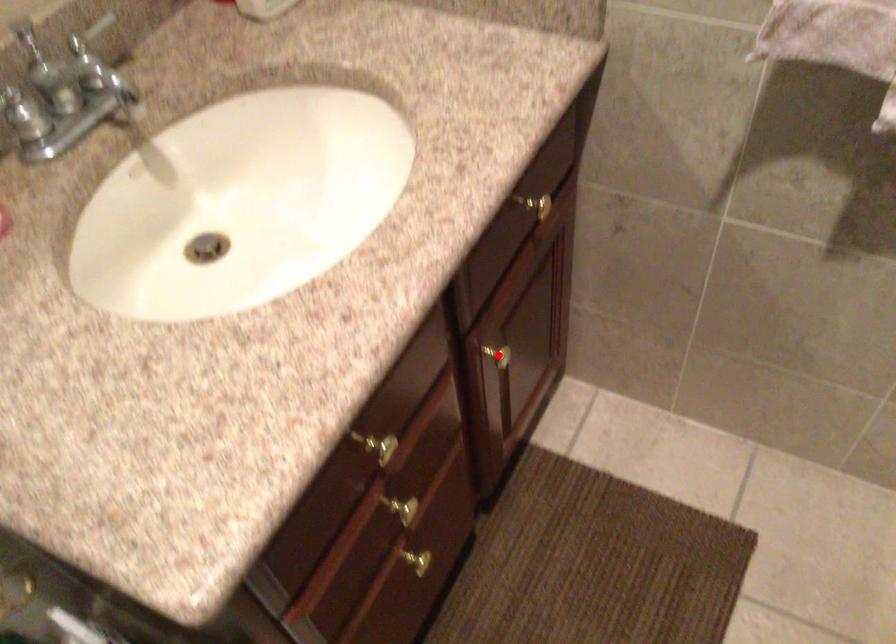
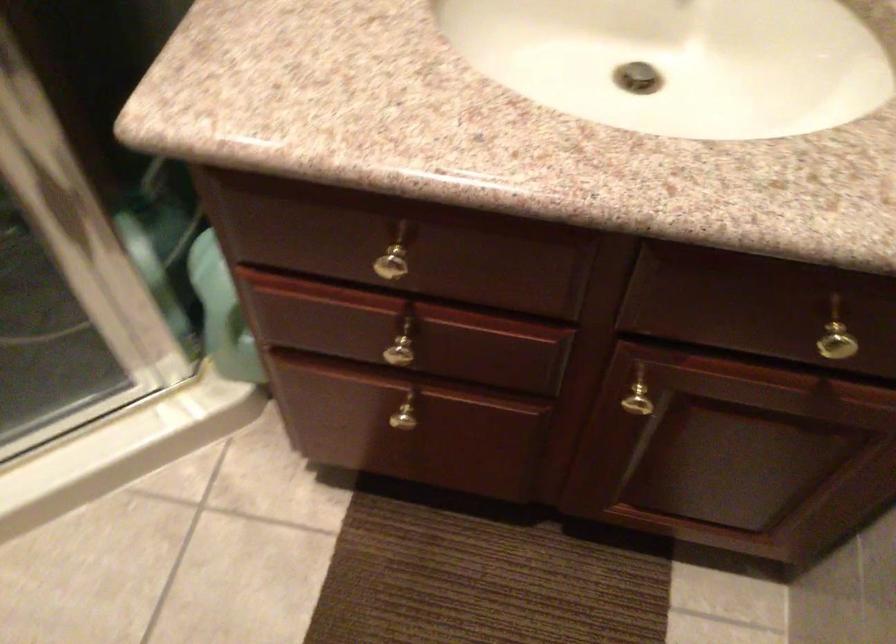
Locate, in the second image, the point that corresponds to the highlighted location in the first image.

(640, 399)